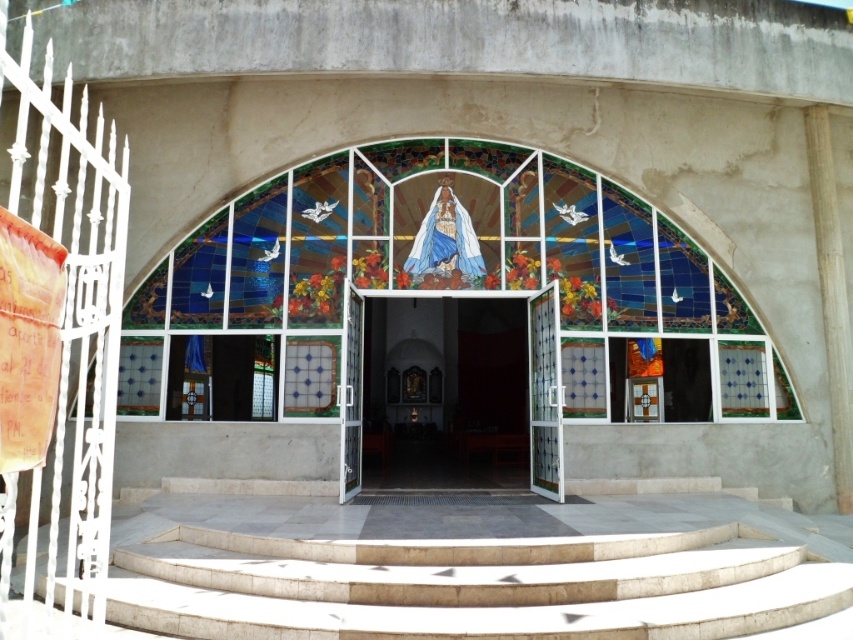
Does stained glass mosaic at center appear on the left side of white glass doors at center?

Yes, stained glass mosaic at center is to the left of white glass doors at center.

Where is `stained glass mosaic at center`? stained glass mosaic at center is located at coordinates (457, 266).

Can you confirm if white stone stairs at center is taller than stained glass mosaic at center?

No.

Is white stone stairs at center positioned before stained glass mosaic at center?

Yes, it is.

Is point (169, 532) positioned in front of point (303, 285)?

Yes, it is in front of point (303, 285).

I want to click on white stone stairs at center, so click(476, 568).

The width and height of the screenshot is (853, 640). What do you see at coordinates (476, 568) in the screenshot?
I see `white stone stairs at center` at bounding box center [476, 568].

Between point (193, 614) and point (426, 317), which one is positioned in front?

Point (193, 614) is in front.

You are a GUI agent. You are given a task and a screenshot of the screen. Output one action in this format:
    pyautogui.click(x=<x>, y=<y>)
    Task: Click on the white stone stairs at center
    
    Given the screenshot: What is the action you would take?
    pyautogui.click(x=476, y=568)